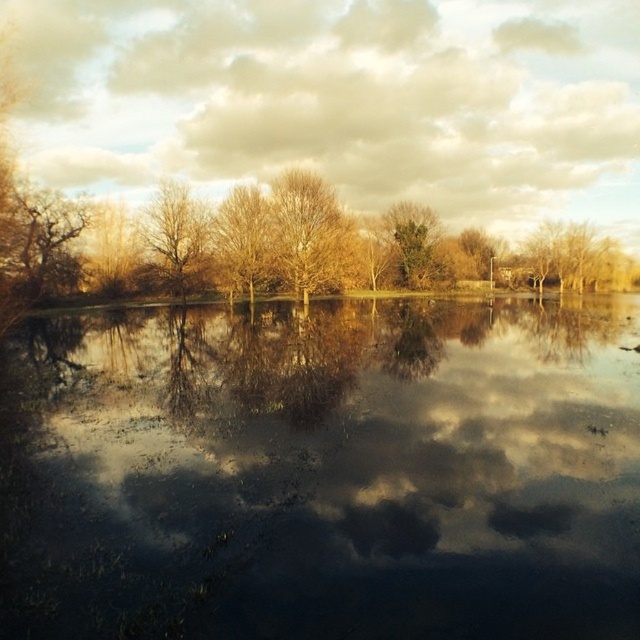
Is golden textured tree at center smaller than bare branches at center?

Actually, golden textured tree at center might be larger than bare branches at center.

Does golden textured tree at center have a greater height compared to bare branches at center?

Correct, golden textured tree at center is much taller as bare branches at center.

Which is in front, point (298, 292) or point (241, 243)?

Positioned in front is point (241, 243).

Locate an element on the screen. This screenshot has width=640, height=640. golden textured tree at center is located at coordinates (310, 232).

Does golden textured tree at center lie in front of brown leafless tree at center?

No.

Who is lower down, golden textured tree at center or brown leafless tree at center?

Positioned lower is brown leafless tree at center.

Does point (273, 212) come farther from viewer compared to point (160, 214)?

Yes, point (273, 212) is farther from viewer.

Locate an element on the screen. Image resolution: width=640 pixels, height=640 pixels. golden textured tree at center is located at coordinates (310, 232).

Can you confirm if black reflective water at center is positioned below golden textured tree at center?

Yes.

Which is more to the right, black reflective water at center or golden textured tree at center?

Positioned to the right is golden textured tree at center.

At what (x,y) coordinates should I click in order to perform the action: click on black reflective water at center. Please return your answer as a coordinate pair (x, y). This screenshot has height=640, width=640. Looking at the image, I should click on (328, 472).

In order to click on black reflective water at center in this screenshot , I will do `click(328, 472)`.